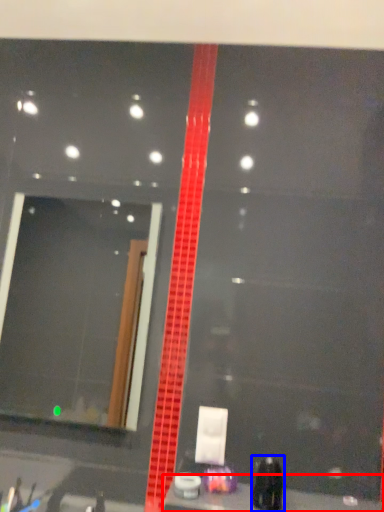
Question: Which point is closer to the camera, counter top (highlighted by a red box) or toiletry (highlighted by a blue box)?

Choices:
 (A) counter top
 (B) toiletry

Answer: (A)